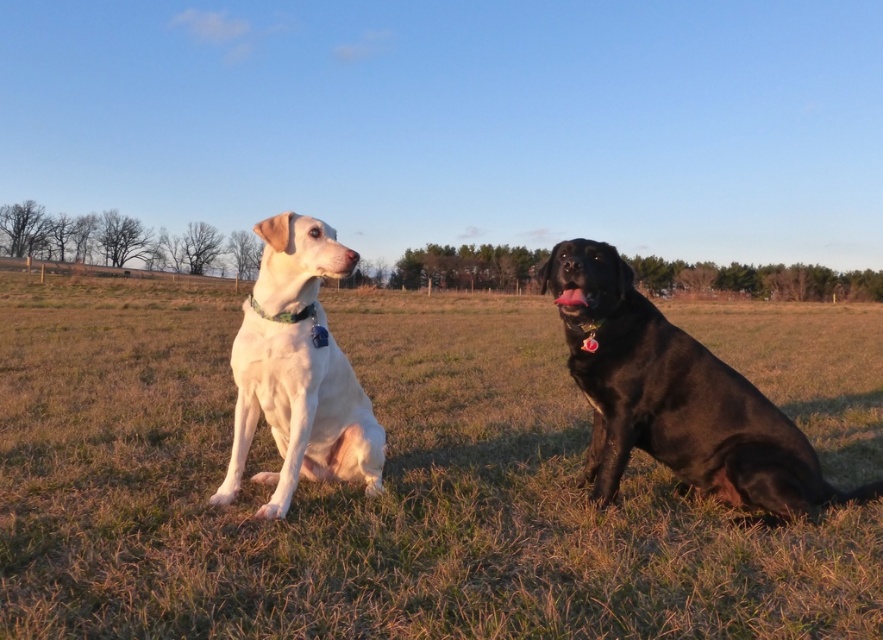
Question: Estimate the real-world distances between objects in this image. Which object is farther from the black glossy dog at right?

Choices:
 (A) grassy field at center
 (B) white matte dog at left

Answer: (A)

Question: Does black glossy dog at right appear over white matte dog at left?

Choices:
 (A) yes
 (B) no

Answer: (B)

Question: Does grassy field at center lie in front of black glossy dog at right?

Choices:
 (A) yes
 (B) no

Answer: (A)

Question: Which point is closer to the camera?

Choices:
 (A) (306, 285)
 (B) (700, 570)
 (C) (668, 392)

Answer: (B)

Question: Which object appears closest to the camera in this image?

Choices:
 (A) grassy field at center
 (B) black glossy dog at right

Answer: (A)

Question: Does grassy field at center come in front of white matte dog at left?

Choices:
 (A) no
 (B) yes

Answer: (B)